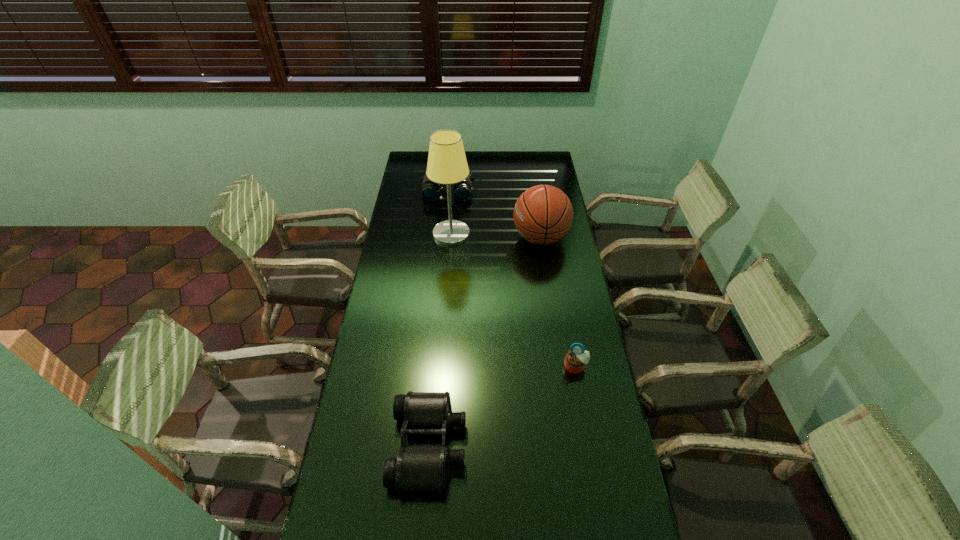
Find the location of a particular element. This screenshot has width=960, height=540. vacant space located 0.130m on the logo side of the fourth shortest object is located at coordinates (483, 238).

Locate an element on the screen. free space located through the lenses of the farthest object is located at coordinates (445, 215).

You are a GUI agent. You are given a task and a screenshot of the screen. Output one action in this format:
    pyautogui.click(x=<x>, y=<y>)
    Task: Click on the vacant space situated on the front-facing side of the muffin
    
    Given the screenshot: What is the action you would take?
    pyautogui.click(x=599, y=498)

You are a GUI agent. You are given a task and a screenshot of the screen. Output one action in this format:
    pyautogui.click(x=<x>, y=<y>)
    Task: Click on the vacant space located 0.100m through the eyepieces of the nearest object
    The image size is (960, 540).
    Given the screenshot: What is the action you would take?
    pyautogui.click(x=499, y=445)

Locate an element on the screen. The image size is (960, 540). basketball situated at the right edge is located at coordinates (543, 214).

Find the location of a particular element. The width and height of the screenshot is (960, 540). muffin located in the right edge section of the desktop is located at coordinates (575, 361).

At what (x,y) coordinates should I click in order to perform the action: click on free location at the far edge. Please return your answer as a coordinate pair (x, y). The height and width of the screenshot is (540, 960). Looking at the image, I should click on (495, 152).

Image resolution: width=960 pixels, height=540 pixels. I want to click on free space at the left edge of the desktop, so coord(369,323).

Locate an element on the screen. The height and width of the screenshot is (540, 960). vacant space at the right edge of the desktop is located at coordinates (542, 185).

Locate an element on the screen. The image size is (960, 540). free spot between the muffin and the basketball is located at coordinates (558, 302).